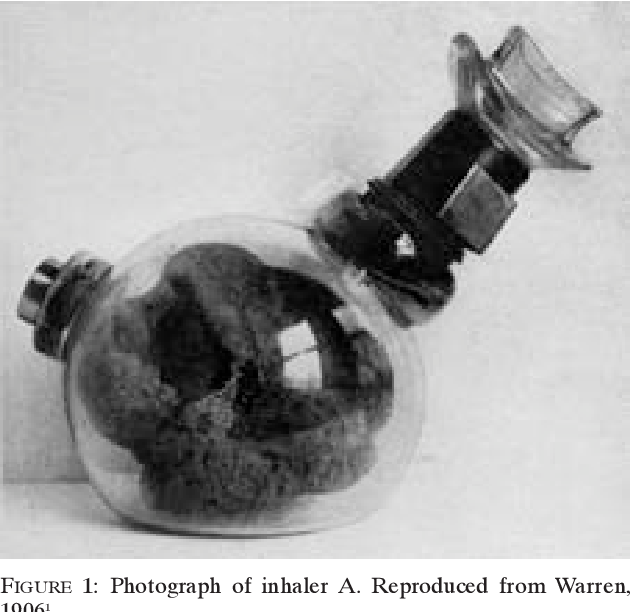
I want to click on looks like a bong to me, so click(x=33, y=289), click(x=227, y=355), click(x=490, y=162).